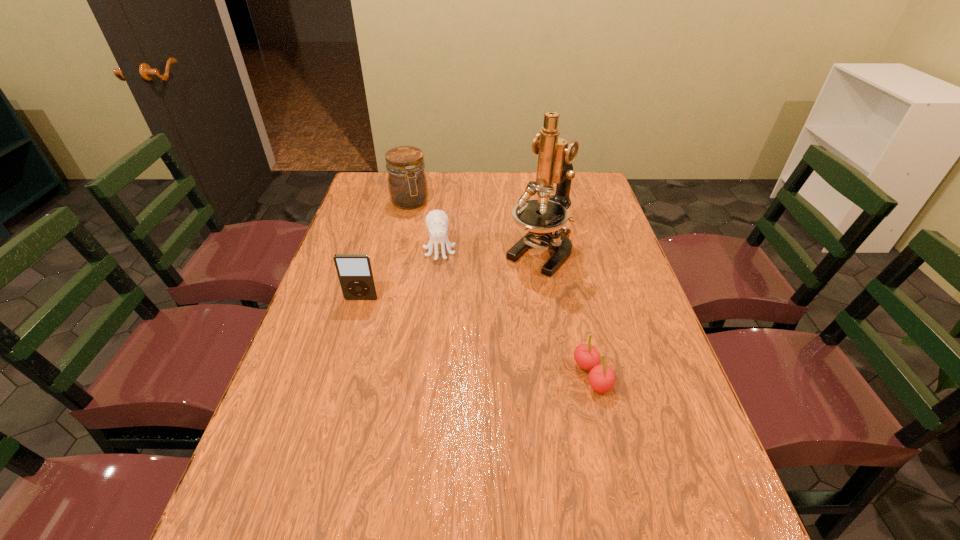
Find the location of a particular element. This screenshot has height=540, width=960. free space located on the back of the shortest object is located at coordinates point(569,279).

I want to click on free space located on the lid of the farthest object, so click(x=422, y=228).

Identify the location of free point located 0.390m on the lid of the farthest object. (449, 282).

In order to click on vacant region located 0.200m on the lid of the farthest object in this screenshot , I will do `click(431, 245)`.

Where is `vacant region located at the eyepiece of the microscope`? The height and width of the screenshot is (540, 960). vacant region located at the eyepiece of the microscope is located at coordinates (496, 299).

Where is `vacant region located 0.230m at the eyepiece of the microscope`? Image resolution: width=960 pixels, height=540 pixels. vacant region located 0.230m at the eyepiece of the microscope is located at coordinates (477, 319).

Find the location of a particular element. This screenshot has width=960, height=540. vacant area situated 0.160m at the eyepiece of the microscope is located at coordinates (492, 303).

In order to click on free location located on the front-facing side of the octopus in this screenshot , I will do `click(445, 308)`.

The width and height of the screenshot is (960, 540). In order to click on free space located 0.260m on the front-facing side of the octopus in this screenshot , I will do `click(447, 325)`.

Find the location of a particular element. vacant region located on the front-facing side of the octopus is located at coordinates (448, 333).